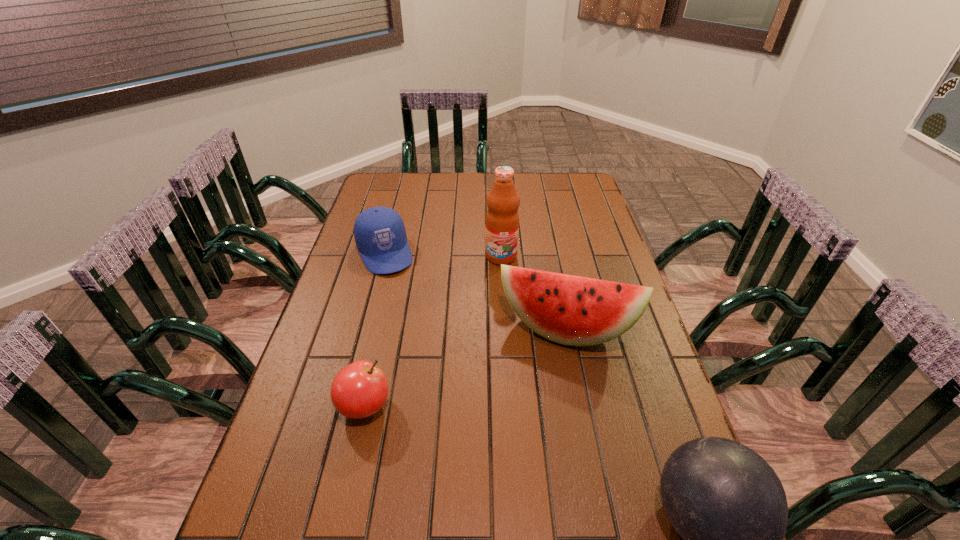
Locate an element on the screen. The image size is (960, 540). vacant space on the desktop that is between the fourth farthest object and the bowling ball and is positioned on the front label of the fruit juice is located at coordinates (495, 450).

What are the coordinates of `vacant space on the desktop that is between the apple and the nearest object and is positioned on the outer rind of the third nearest object` in the screenshot? It's located at [544, 467].

Locate an element on the screen. The width and height of the screenshot is (960, 540). free spot on the desktop that is between the fourth farthest object and the bowling ball and is positioned on the front-facing side of the cap is located at coordinates (469, 441).